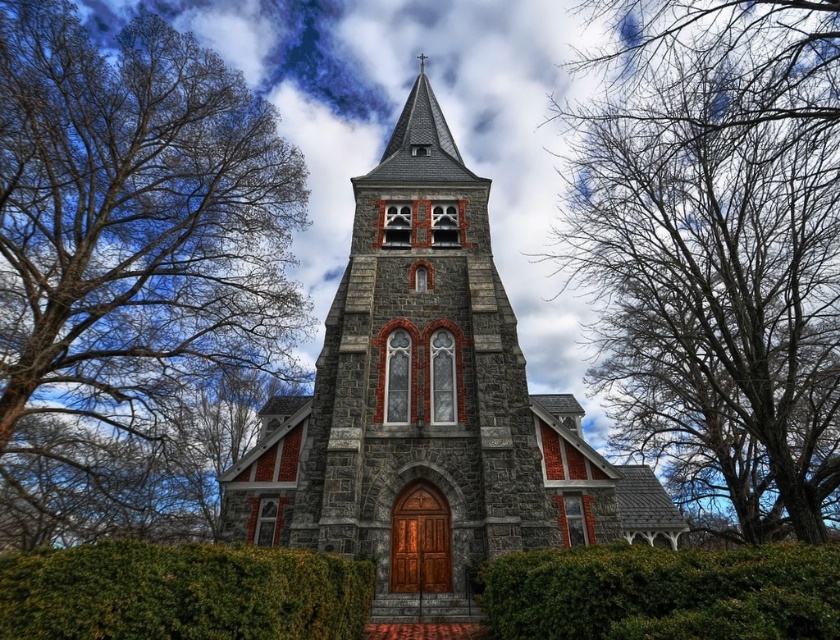
Question: Which object is farther from the camera taking this photo?

Choices:
 (A) green leafy hedge at lower center
 (B) bare branches at left
 (C) gray stone church at center
 (D) bare branches at upper left

Answer: (B)

Question: Estimate the real-world distances between objects in this image. Which object is farther from the bare branches at left?

Choices:
 (A) gray stone church at center
 (B) green leafy hedge at center

Answer: (B)

Question: Which point is closer to the camera?

Choices:
 (A) bare branches at left
 (B) green leafy hedge at lower center
 (C) gray stone church at center

Answer: (B)

Question: Does bare branches at left appear on the left side of green leafy hedge at lower center?

Choices:
 (A) yes
 (B) no

Answer: (A)

Question: Can you confirm if bare branches at left is wider than gray stone church at center?

Choices:
 (A) no
 (B) yes

Answer: (A)

Question: Is bare branches at upper left positioned before green leafy hedge at lower center?

Choices:
 (A) no
 (B) yes

Answer: (A)